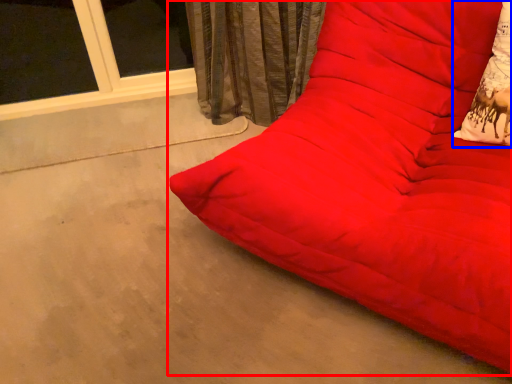
Question: Which of the following is the farthest to the observer, studio couch (highlighted by a red box) or throw pillow (highlighted by a blue box)?

Choices:
 (A) studio couch
 (B) throw pillow

Answer: (B)